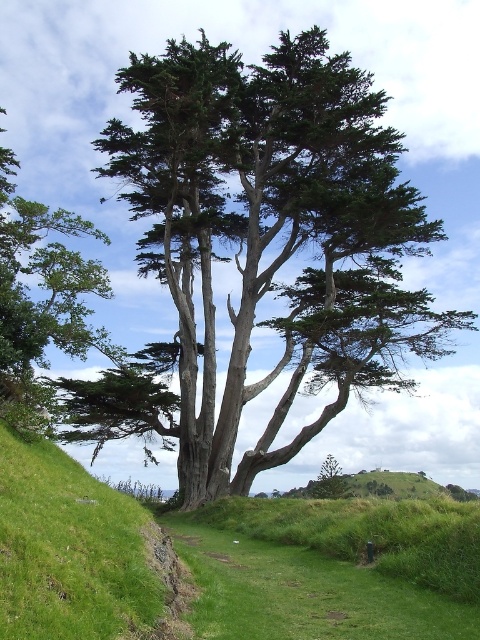
Question: Does green grassy at lower center have a lesser width compared to green rough bark tree at upper center?

Choices:
 (A) no
 (B) yes

Answer: (B)

Question: Where is green grassy at lower center located in relation to green rough bark tree at upper center in the image?

Choices:
 (A) right
 (B) left

Answer: (A)

Question: Which point is closer to the camera?

Choices:
 (A) (85, 262)
 (B) (466, 509)

Answer: (B)

Question: Can you confirm if green grassy at lower center is smaller than green rough bark tree at upper center?

Choices:
 (A) no
 (B) yes

Answer: (B)